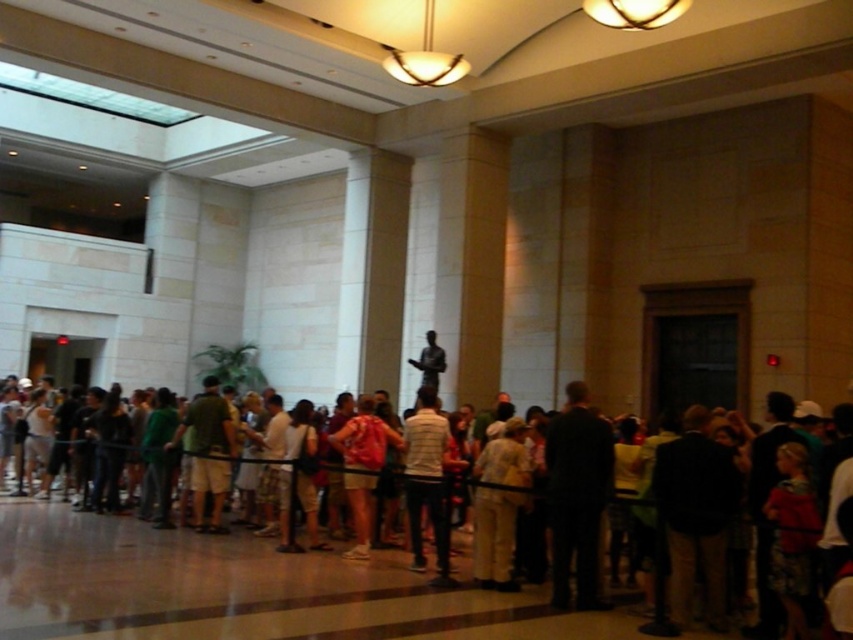
You are standing at the entrance of the museum and see the matte black statue at center. Can you see the statue from your current position?

Yes, because the matte black statue at center is located at point (x=250, y=589), which is within the visible area from the entrance.

You are a visitor standing at the entrance of the museum. You see two items in the center of the room. Which one is closer to you? The light beige pants at center or the bronze statue at center?

The light beige pants at center is closer to you since it is in front of the bronze statue at center.

You are standing at the entrance of the museum and notice two items at the center of the room. Which one is positioned to the left when viewed from your perspective? The items are the matte black statue at center and the light beige pants at center.

The matte black statue at center is positioned to the left of the light beige pants at center.